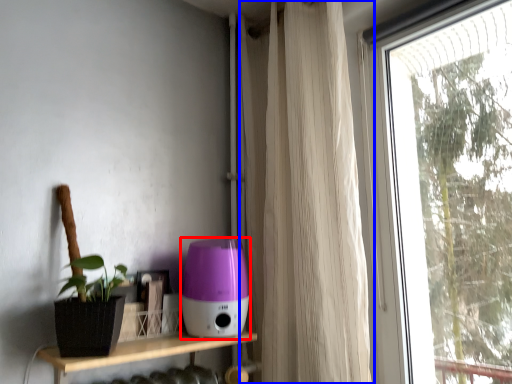
Question: Which of the following is the farthest to the observer, appliance (highlighted by a red box) or curtain (highlighted by a blue box)?

Choices:
 (A) appliance
 (B) curtain

Answer: (A)